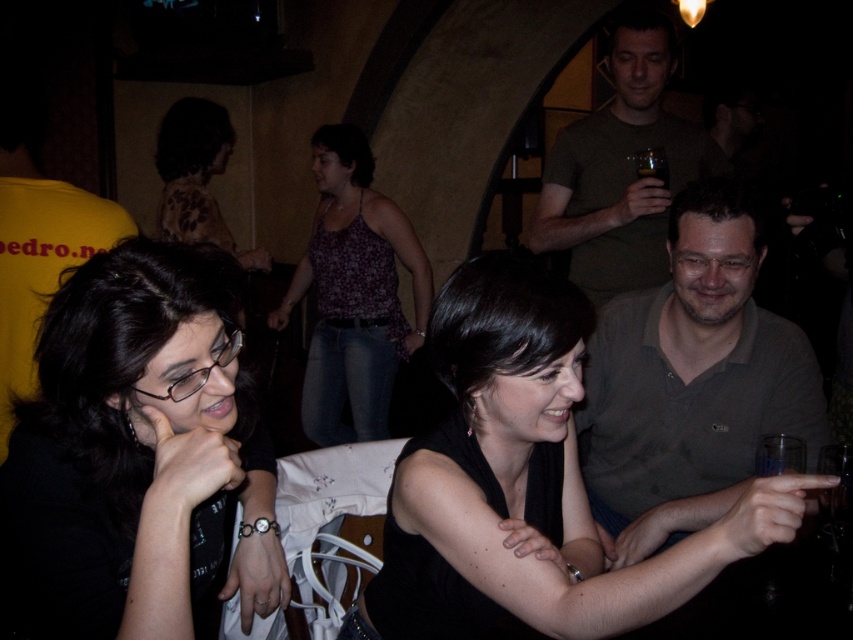
You are at a social gathering in a dimly lit bar or restaurant. You see two women seated at a table in the foreground. One has dark hair and glasses, the other has shoulder length dark hair and is wearing a sleeveless black top. There is also a point marked at coordinates (x=526, y=483). What object is located at this point?

The point at coordinates (x=526, y=483) marks the location of the black matte dress at center.

You are at a social gathering in a dimly lit bar or restaurant. You see two women seated at a table in the foreground. One has dark hair in a bob and glasses, the other has shoulder length dark hair and a sleeveless black top. There is also a point marked at coordinates (141, 449). What object or feature does this point indicate?

The point at (141, 449) indicates black matte hair at center.